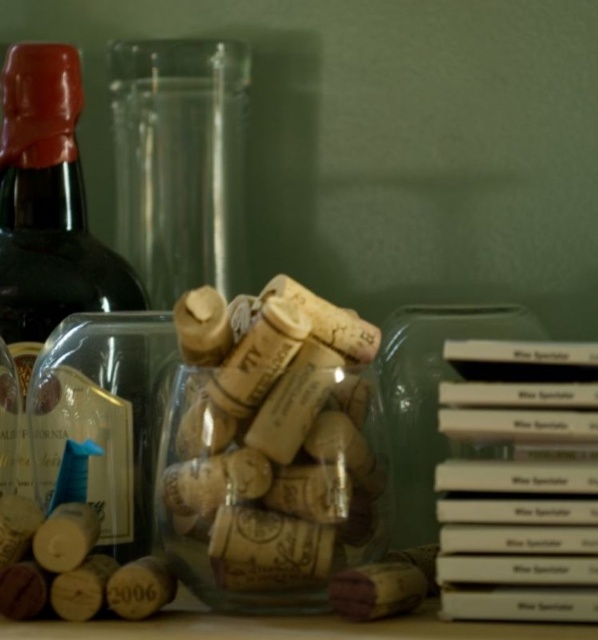
Is point (1, 304) closer to camera compared to point (454, 449)?

No, it is not.

Can you confirm if matte dark green bottle at left is wider than transparent plastic jar at center?

In fact, matte dark green bottle at left might be narrower than transparent plastic jar at center.

Who is more distant from viewer, (8, 224) or (423, 308)?

The point (8, 224) is more distant.

The image size is (598, 640). I want to click on matte dark green bottle at left, so click(48, 202).